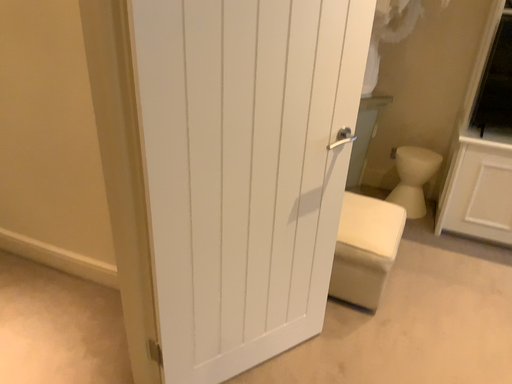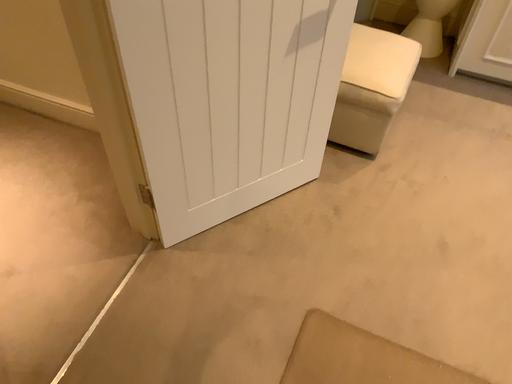
Question: Which way did the camera rotate in the video?

Choices:
 (A) rotated upward
 (B) rotated downward

Answer: (B)